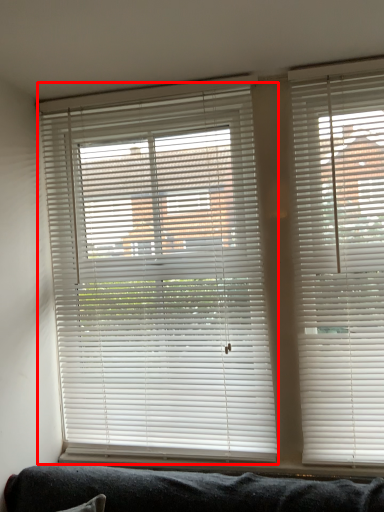
Question: From the image's perspective, what is the correct spatial positioning of window blind (annotated by the red box) in reference to window blind?

Choices:
 (A) below
 (B) above

Answer: (A)